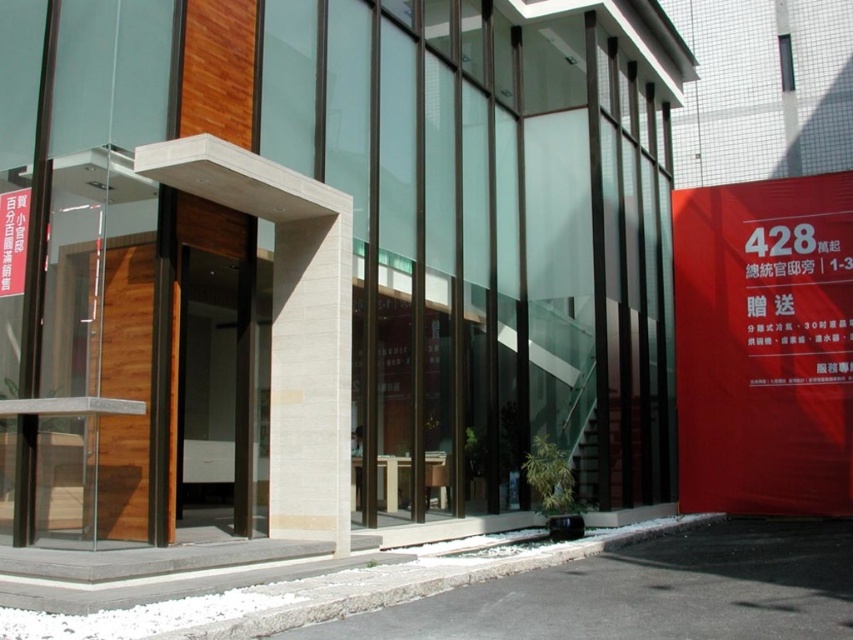
You are a visitor approaching the building and need to locate the entrance. Which object, the red matte sign at right or the brown wooden door at center, is smaller in size and might be harder to notice from a distance?

The red matte sign at right occupies less space than the brown wooden door at center, so it is smaller and might be harder to notice from a distance.

You are standing at the entrance of the modern building and want to walk towards the point labeled as point (x=202, y=392). After reaching there, if you look forward, will you see the point labeled as point (x=819, y=189) in your line of sight?

Since point (x=819, y=189) is behind point (x=202, y=392), you will not see point (x=819, y=189) in your line of sight after reaching point (x=202, y=392).

You are standing at point (764, 346) in the image. What object is located exactly at your current position?

The red matte sign at right is located exactly at point (764, 346).